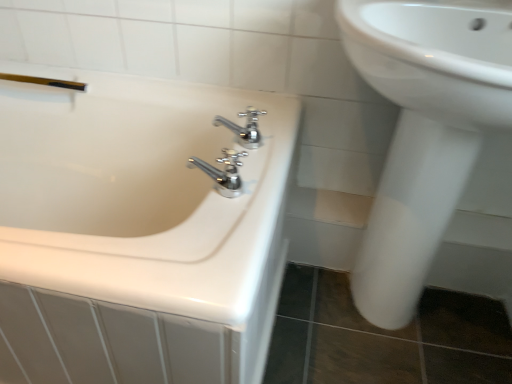
Question: From a real-world perspective, is chrome metallic faucet at center, the 2th tap ordered from the bottom, below white glossy sink at right?

Choices:
 (A) no
 (B) yes

Answer: (A)

Question: Is chrome metallic faucet at center, the 2th tap ordered from the bottom, outside of white glossy sink at right?

Choices:
 (A) no
 (B) yes

Answer: (B)

Question: Is chrome metallic faucet at center, arranged as the first tap when viewed from the top, to the left of white glossy sink at right from the viewer's perspective?

Choices:
 (A) no
 (B) yes

Answer: (B)

Question: Considering the relative sizes of chrome metallic faucet at center, which ranks as the 2th tap in front-to-back order, and white glossy sink at right in the image provided, is chrome metallic faucet at center, which ranks as the 2th tap in front-to-back order, taller than white glossy sink at right?

Choices:
 (A) no
 (B) yes

Answer: (A)

Question: Is chrome metallic faucet at center, arranged as the first tap when viewed from the top, to the right of white glossy sink at right from the viewer's perspective?

Choices:
 (A) yes
 (B) no

Answer: (B)

Question: Is chrome metallic faucet at center, the 2th tap ordered from the bottom, aimed at white glossy sink at right?

Choices:
 (A) yes
 (B) no

Answer: (B)

Question: Can you see white glossy bathtub at left touching chrome metallic faucet at center, the 2th tap ordered from the bottom?

Choices:
 (A) yes
 (B) no

Answer: (B)

Question: Considering the relative sizes of white glossy bathtub at left and chrome metallic faucet at center, acting as the first tap starting from the back, in the image provided, is white glossy bathtub at left smaller than chrome metallic faucet at center, acting as the first tap starting from the back,?

Choices:
 (A) yes
 (B) no

Answer: (B)

Question: Is white glossy bathtub at left turned away from chrome metallic faucet at center, arranged as the first tap when viewed from the top?

Choices:
 (A) no
 (B) yes

Answer: (A)

Question: Is the depth of white glossy bathtub at left less than that of chrome metallic faucet at center, which ranks as the 2th tap in front-to-back order?

Choices:
 (A) no
 (B) yes

Answer: (B)

Question: Is white glossy bathtub at left aimed at chrome metallic faucet at center, arranged as the first tap when viewed from the top?

Choices:
 (A) yes
 (B) no

Answer: (B)

Question: Does white glossy bathtub at left have a lesser width compared to chrome metallic faucet at center, which ranks as the 2th tap in front-to-back order?

Choices:
 (A) no
 (B) yes

Answer: (A)

Question: Does chrome metallic faucet at center, the 2th tap ordered from the bottom, turn towards white glossy bathtub at left?

Choices:
 (A) no
 (B) yes

Answer: (A)